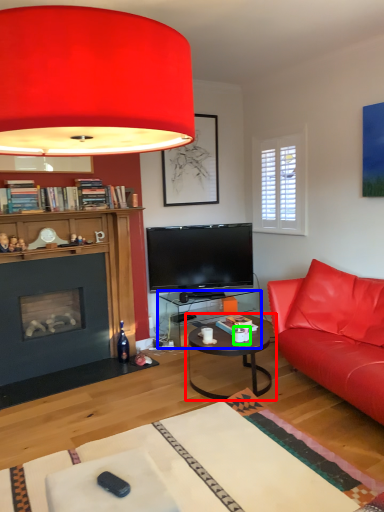
Question: Considering the real-world distances, which object is closest to coffee table (highlighted by a red box)? desk (highlighted by a blue box) or coffee cup (highlighted by a green box).

Choices:
 (A) desk
 (B) coffee cup

Answer: (B)